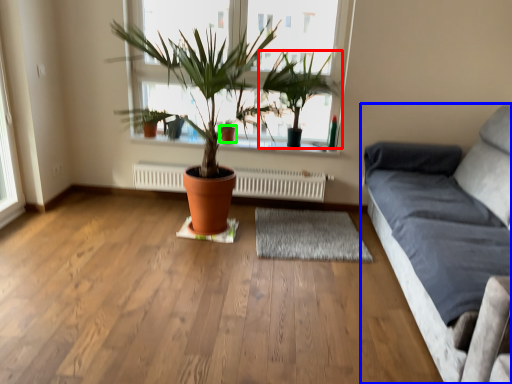
Question: Which object is the farthest from houseplant (highlighted by a red box)? Choose among these: studio couch (highlighted by a blue box) or flowerpot (highlighted by a green box).

Choices:
 (A) studio couch
 (B) flowerpot

Answer: (A)